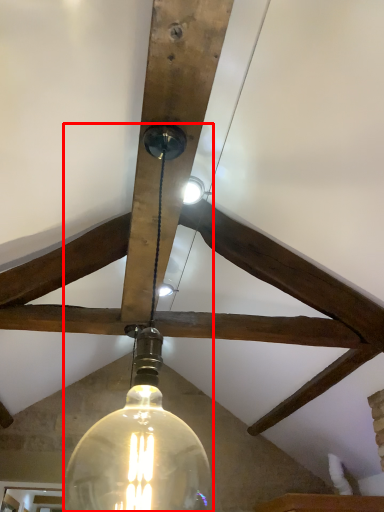
Question: From the image, what is the correct spatial relationship of lamp (annotated by the red box) in relation to light bulb?

Choices:
 (A) left
 (B) right

Answer: (B)